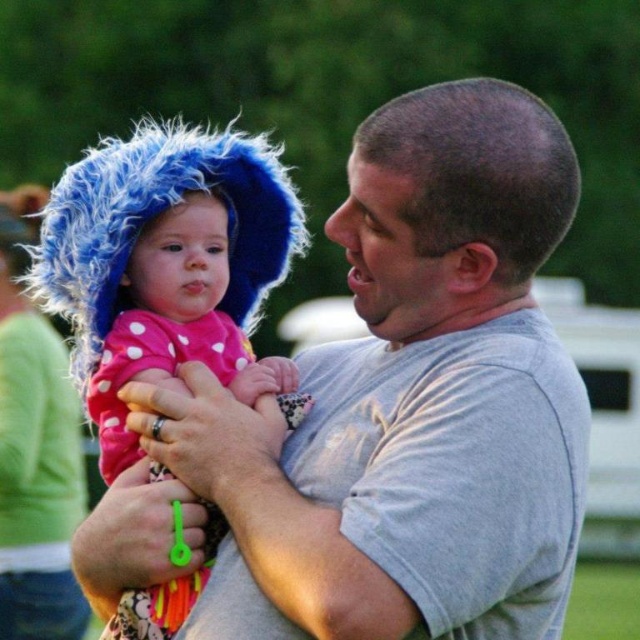
In the image, there are two points labeled as point (474,269) and point (141,305). From the perspective of someone looking at the image, which point is closer to the viewer?

Point (474,269) is in front of point (141,305), so it is closer to the viewer.

You are designing a new baby carrier that needs to accommodate both the gray cotton shirt at center and the fuzzy blue hat at upper left. Since the carrier has a limited width, which object should be prioritized to ensure it fits comfortably?

The gray cotton shirt at center should be prioritized because its width is larger than the fuzzy blue hat at upper left, so it requires more space in the carrier.